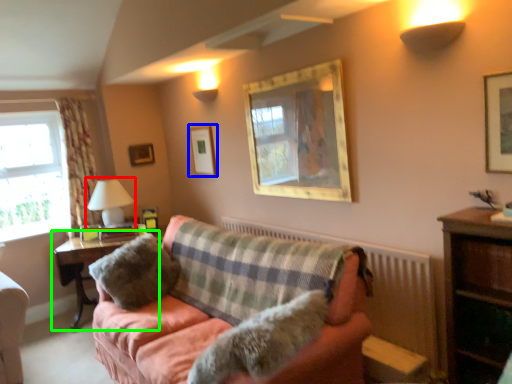
Question: Estimate the real-world distances between objects in this image. Which object is farther from table lamp (highlighted by a red box), picture frame (highlighted by a blue box) or table (highlighted by a green box)?

Choices:
 (A) picture frame
 (B) table

Answer: (A)